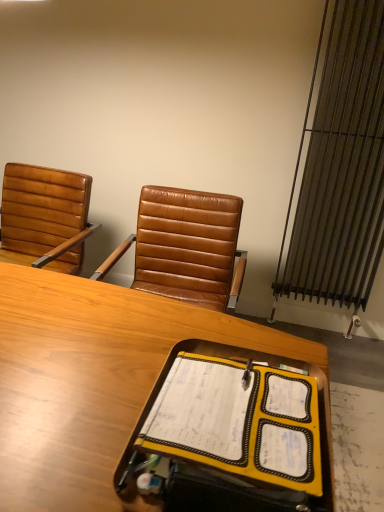
Question: Visually, is wooden desk at center positioned to the left or to the right of metallic silver radiator at right?

Choices:
 (A) left
 (B) right

Answer: (A)

Question: Is wooden desk at center spatially inside metallic silver radiator at right, or outside of it?

Choices:
 (A) outside
 (B) inside

Answer: (A)

Question: Based on their relative distances, which object is farther from the brown leather chair at left?

Choices:
 (A) wooden desk at center
 (B) yellow fabric notebook at center
 (C) metallic silver radiator at right

Answer: (B)

Question: Considering the real-world distances, which object is closest to the wooden desk at center?

Choices:
 (A) metallic silver radiator at right
 (B) yellow fabric notebook at center
 (C) brown leather chair at left

Answer: (B)